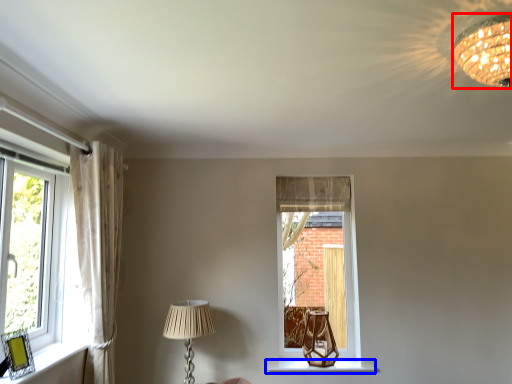
Question: Which object appears farthest to the camera in this image, lamp (highlighted by a red box) or window sill (highlighted by a blue box)?

Choices:
 (A) lamp
 (B) window sill

Answer: (B)